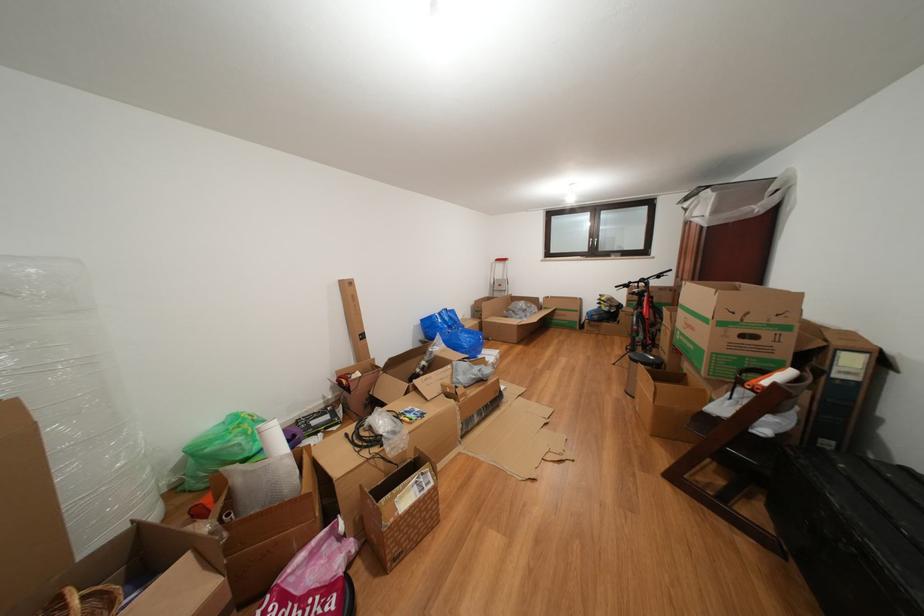
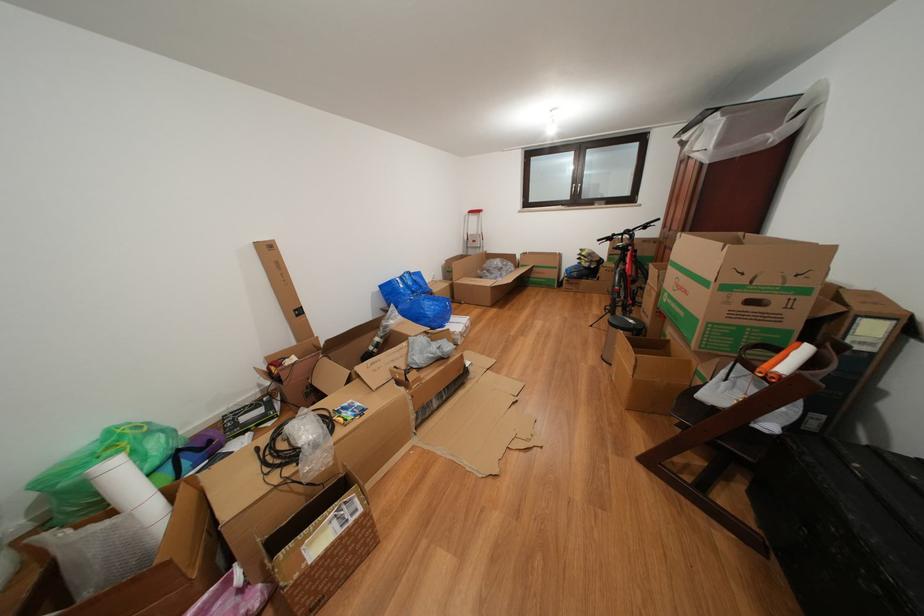
Where in the second image is the point corresponding to (537,320) from the first image?

(513, 280)